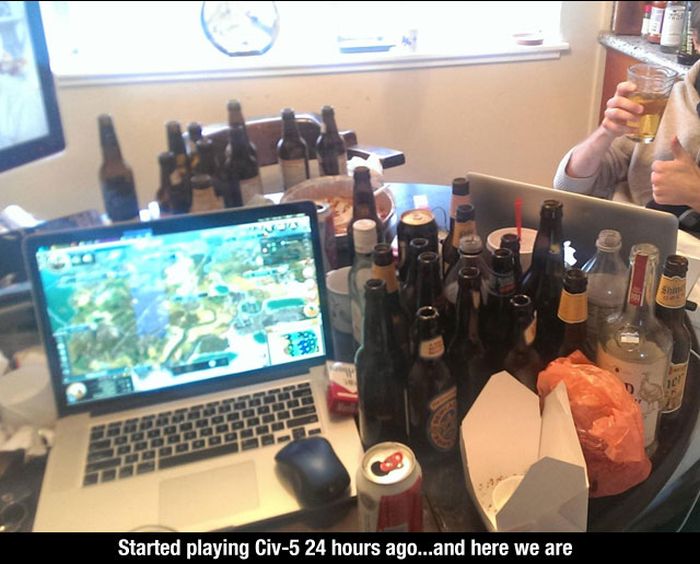
Where is `window`? This screenshot has width=700, height=564. window is located at coordinates (145, 17), (83, 549).